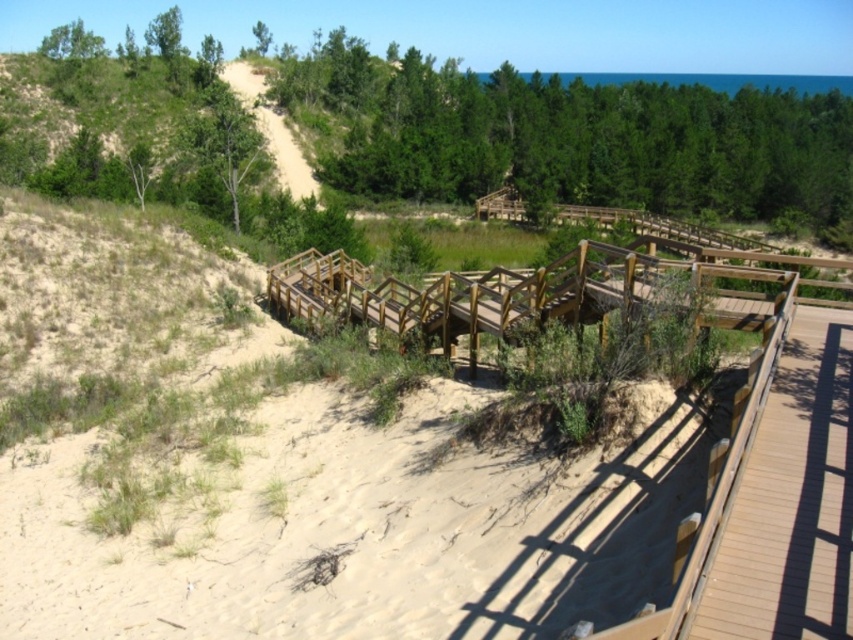
Between point (801, 397) and point (312, 177), which one is positioned in front?

Point (801, 397) is more forward.

Does brown wood boardwalk at right appear under smooth sand path at upper left?

Yes.

Is point (740, 580) less distant than point (305, 180)?

Yes, point (740, 580) is closer to viewer.

Locate an element on the screen. brown wood boardwalk at right is located at coordinates (790, 500).

Does point (494, 540) come behind point (526, 323)?

No, (494, 540) is closer to viewer.

From the picture: Between light brown sandy path at center and wooden stairs at center, which one has more height?

Standing taller between the two is light brown sandy path at center.

Who is more distant from viewer, [312,624] or [637,292]?

The point [637,292] is behind.

At what (x,y) coordinates should I click in order to perform the action: click on light brown sandy path at center. Please return your answer as a coordinate pair (x, y). This screenshot has height=640, width=853. Looking at the image, I should click on (281, 468).

Who is shorter, wooden stairs at center or smooth sand path at upper left?

Standing shorter between the two is wooden stairs at center.

Who is more forward, (560, 273) or (289, 173)?

Point (560, 273) is in front.

This screenshot has width=853, height=640. In order to click on wooden stairs at center in this screenshot , I will do `click(514, 294)`.